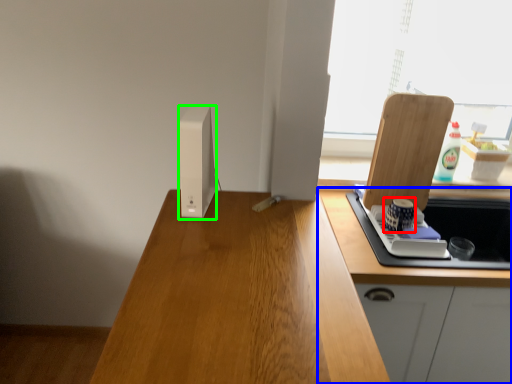
Question: Which object is positioned closest to appliance (highlighted by a red box)? Select from cabinetry (highlighted by a blue box) and appliance (highlighted by a green box).

Choices:
 (A) cabinetry
 (B) appliance

Answer: (A)